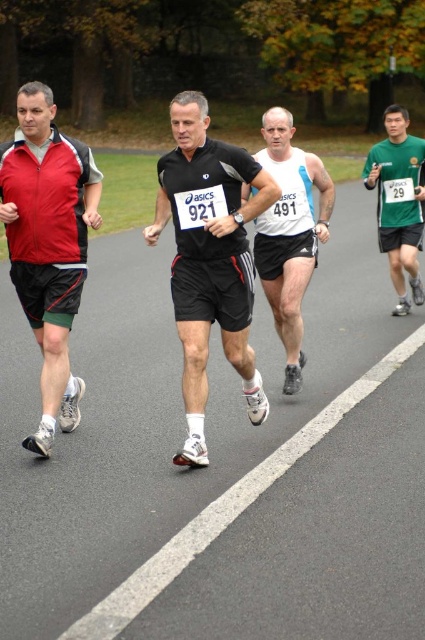
Question: Which is nearer to the black matte running shoe at center?

Choices:
 (A) white matte running shirt at center
 (B) green matte shirt at right
 (C) matte red jacket at left

Answer: (C)

Question: Does matte red jacket at left have a smaller size compared to white matte running shirt at center?

Choices:
 (A) no
 (B) yes

Answer: (A)

Question: Is matte red jacket at left to the right of green matte shirt at right from the viewer's perspective?

Choices:
 (A) yes
 (B) no

Answer: (B)

Question: Which of the following is the closest to the observer?

Choices:
 (A) (88, 193)
 (B) (394, 216)

Answer: (A)

Question: Can you confirm if black matte running shoe at center is thinner than green matte shirt at right?

Choices:
 (A) no
 (B) yes

Answer: (A)

Question: Which is farther from the black matte running shoe at center?

Choices:
 (A) white matte running shirt at center
 (B) green matte shirt at right
 (C) matte red jacket at left

Answer: (B)